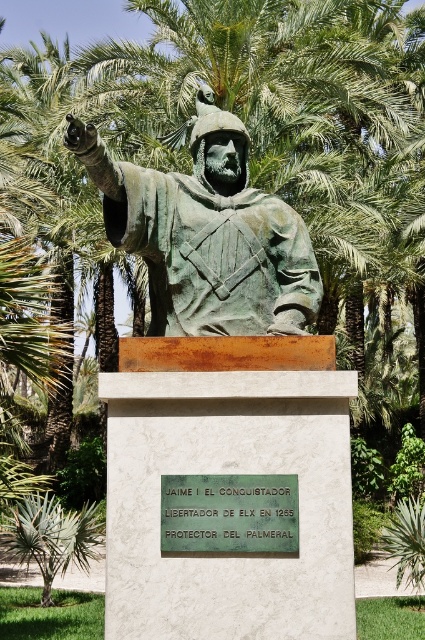
Question: Does bronze statue at center have a greater width compared to green leafy palm tree at lower left?

Choices:
 (A) yes
 (B) no

Answer: (B)

Question: Which of the following is the farthest from the observer?

Choices:
 (A) (x=47, y=499)
 (B) (x=297, y=288)

Answer: (A)

Question: Among these objects, which one is nearest to the camera?

Choices:
 (A) green leafy palm tree at lower left
 (B) bronze statue at center

Answer: (B)

Question: Can you confirm if bronze statue at center is positioned above green leafy palm tree at lower left?

Choices:
 (A) no
 (B) yes

Answer: (B)

Question: Is bronze statue at center further to camera compared to green leafy palm tree at lower left?

Choices:
 (A) yes
 (B) no

Answer: (B)